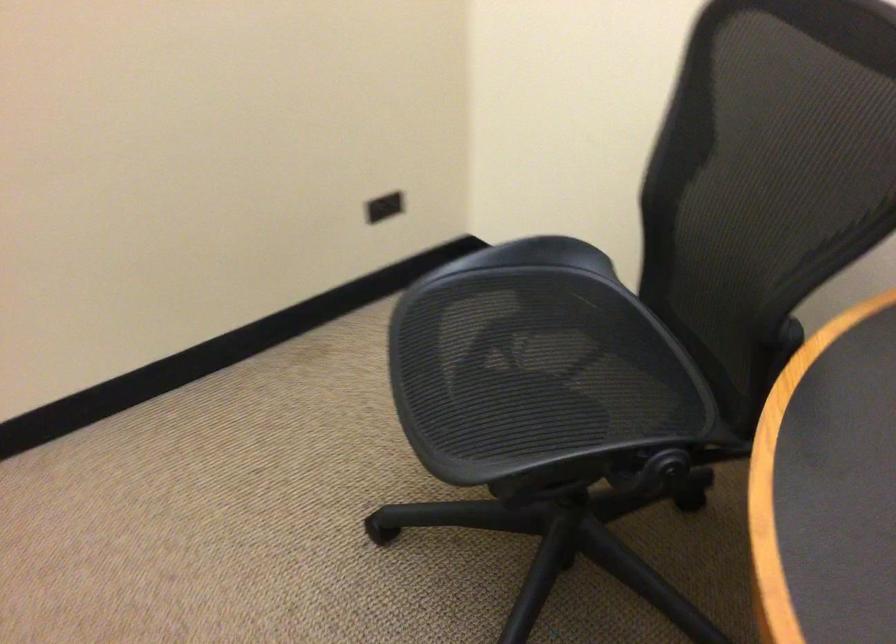
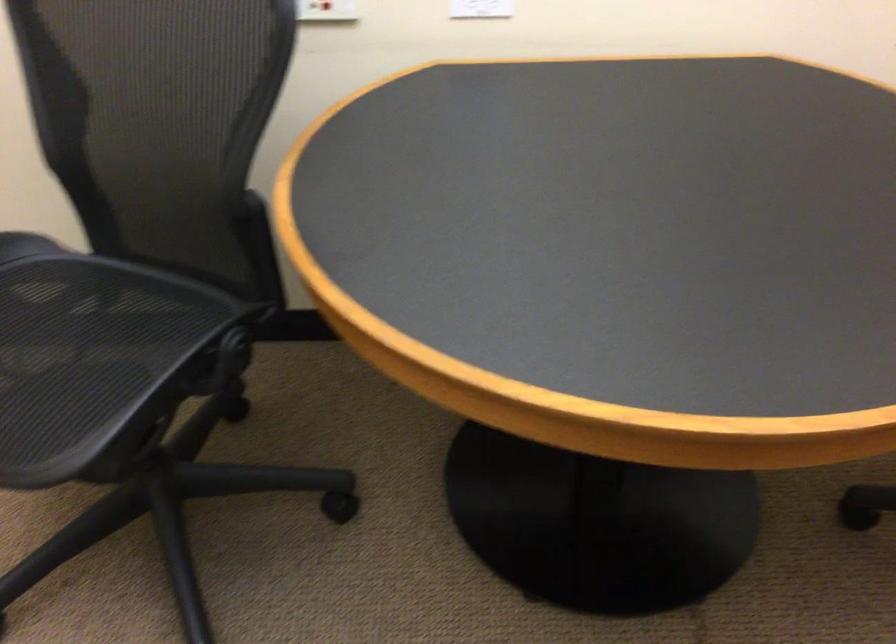
The point at [528,401] is marked in the first image. Where is the corresponding point in the second image?

(75, 373)